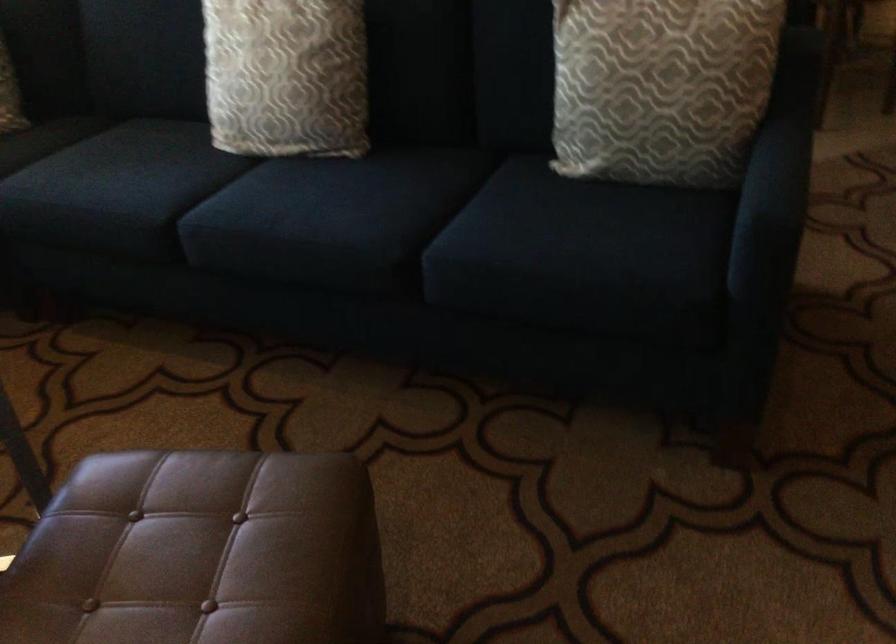
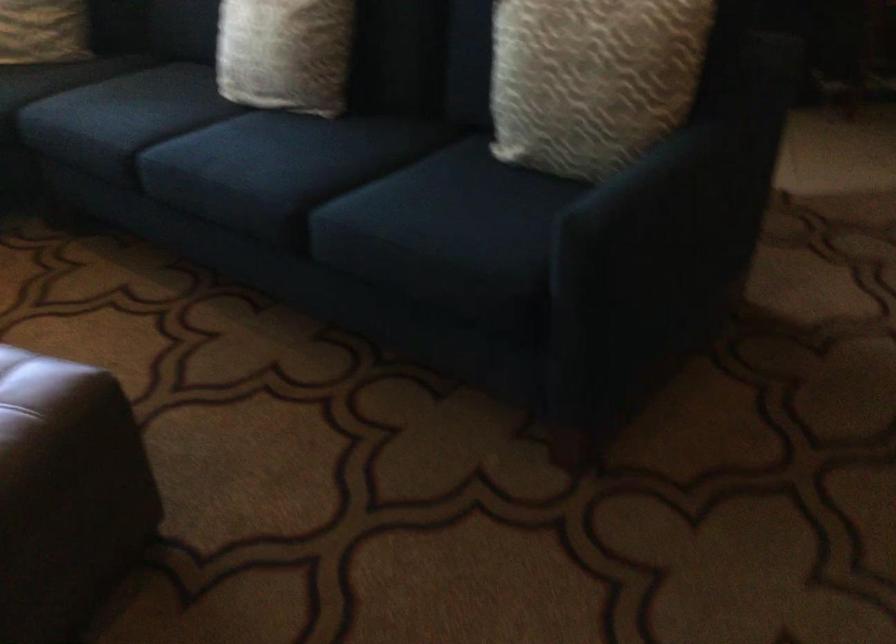
Find the pixel in the second image that matches point 790,178 in the first image.

(687, 190)